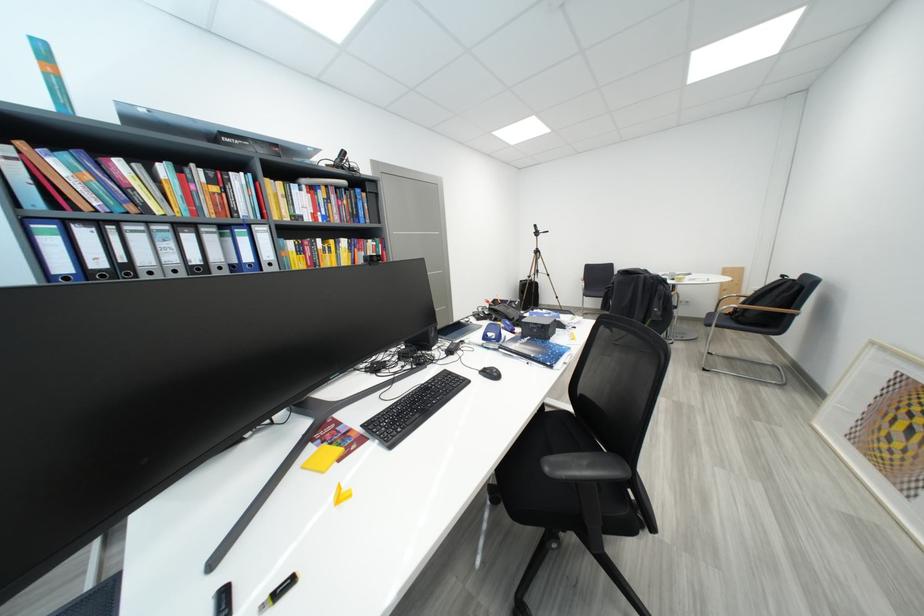
Find where to resting arm the wooden chair armrest. Please return your answer as a coordinate pair (x, y).

(754, 309)